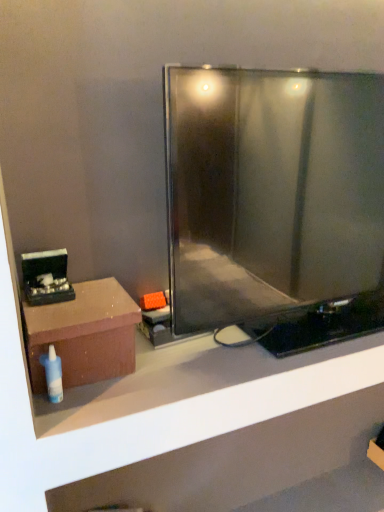
This screenshot has height=512, width=384. Identify the location of vacant space in front of black glossy jewelry box at left. (52, 318).